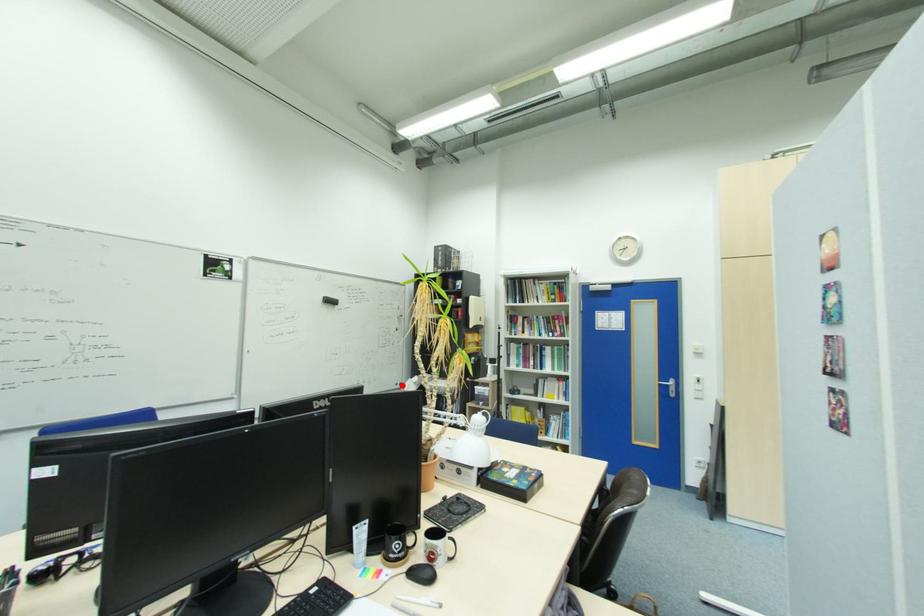
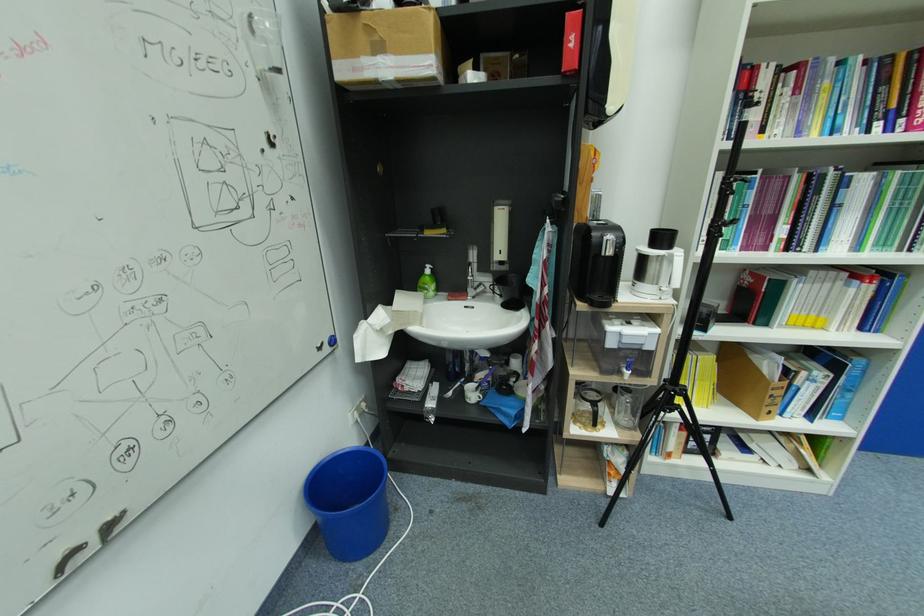
Find the pixel in the second image that matches the highlighted location in the first image.

(330, 346)